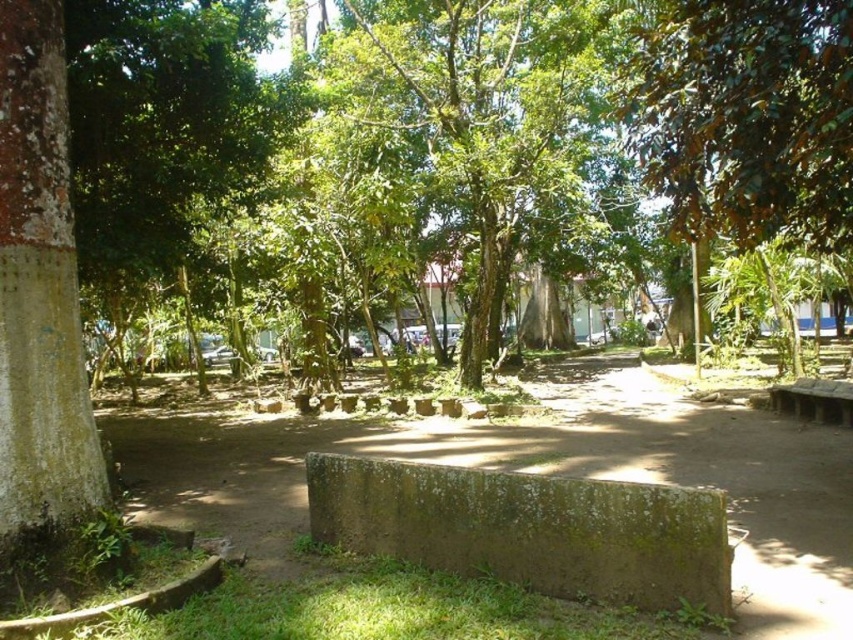
You are a painter standing in the park and want to paint both the smooth brown tree trunk at left and the brown wooden bench at lower right. Which object should you move closer to if you want to capture its full height in your painting?

The smooth brown tree trunk at left is taller than the brown wooden bench at lower right, so you should move closer to the smooth brown tree trunk at left to capture its full height.

You are planning to place a small garden statue between the green leafy tree at center and the smooth brown tree trunk at left. Which tree should the statue be closer to if you want it to appear proportionally smaller in the scene?

The statue should be placed closer to the green leafy tree at center because it is larger in size than the smooth brown tree trunk at left, making the statue appear proportionally smaller when near the bigger tree.

You are a park visitor carrying a 10 meter long ladder. You need to place it between the smooth brown tree trunk at left and the brown wooden bench at lower right. Is there enough space between them to place the ladder horizontally?

The distance between the smooth brown tree trunk at left and the brown wooden bench at lower right is 9.35 meters. Since the ladder is 10 meters long, it is slightly too long to fit horizontally between them.